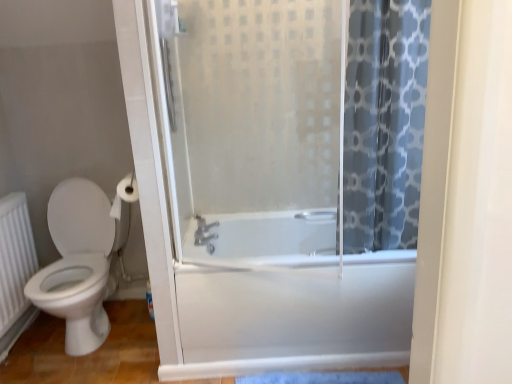
Identify the location of white matte toilet paper at upper left. The image size is (512, 384). tap(124, 194).

The image size is (512, 384). I want to click on white textured radiator at lower left, so click(15, 258).

Find the location of `white glossy bathtub at center`. white glossy bathtub at center is located at coordinates (290, 292).

What is the approximate width of satin nickel faucet at center?

satin nickel faucet at center is 5.53 inches in width.

The width and height of the screenshot is (512, 384). I want to click on blue printed fabric at right, so click(x=384, y=123).

At what (x,y) coordinates should I click in order to perform the action: click on frosted glass shower door at center. Please return your answer as a coordinate pair (x, y). The height and width of the screenshot is (384, 512). Looking at the image, I should click on (253, 127).

Would you say white textured radiator at lower left contains blue printed fabric at right?

No.

Is there a large distance between white textured radiator at lower left and blue printed fabric at right?

Yes.

Is white textured radiator at lower left oriented away from blue printed fabric at right?

No, white textured radiator at lower left's orientation is not away from blue printed fabric at right.

Considering the positions of objects white textured radiator at lower left and blue printed fabric at right in the image provided, who is behind, white textured radiator at lower left or blue printed fabric at right?

white textured radiator at lower left is further from the camera.

Considering the relative sizes of white glossy bathtub at center and frosted glass shower door at center in the image provided, is white glossy bathtub at center shorter than frosted glass shower door at center?

Yes, white glossy bathtub at center is shorter than frosted glass shower door at center.

From a real-world perspective, is white glossy bathtub at center on frosted glass shower door at center?

No, from a real-world perspective, white glossy bathtub at center is not over frosted glass shower door at center

Is white glossy bathtub at center directly adjacent to frosted glass shower door at center?

No, white glossy bathtub at center is not in contact with frosted glass shower door at center.

Is point (262, 242) closer or farther from the camera than point (191, 80)?

Point (262, 242) appears to be farther away from the viewer than point (191, 80).

Is white glossy toilet at left not close to white matte toilet paper at upper left?

white glossy toilet at left is actually quite close to white matte toilet paper at upper left.

From the image's perspective, which object appears higher, white glossy toilet at left or white matte toilet paper at upper left?

white matte toilet paper at upper left.

At what (x,y) coordinates should I click in order to perform the action: click on toilet located on the left of white matte toilet paper at upper left. Please return your answer as a coordinate pair (x, y). Looking at the image, I should click on (80, 262).

Who is taller, frosted glass shower door at center or blue printed fabric at right?

blue printed fabric at right is taller.

Is frosted glass shower door at center bigger or smaller than blue printed fabric at right?

In the image, frosted glass shower door at center appears to be smaller than blue printed fabric at right.

Is frosted glass shower door at center not close to blue printed fabric at right?

They are positioned close to each other.

Is frosted glass shower door at center surrounding white glossy toilet at left?

No.

The height and width of the screenshot is (384, 512). I want to click on screen door that is above the white glossy toilet at left (from the image's perspective), so click(253, 127).

Are frosted glass shower door at center and white glossy toilet at left beside each other?

No.

In terms of height, does frosted glass shower door at center look taller or shorter compared to white glossy toilet at left?

In the image, frosted glass shower door at center appears to be taller than white glossy toilet at left.

Between satin nickel faucet at center and white glossy bathtub at center, which one has smaller width?

Thinner between the two is satin nickel faucet at center.

Is satin nickel faucet at center oriented away from white glossy bathtub at center?

No, satin nickel faucet at center is not facing the opposite direction of white glossy bathtub at center.

Which is in front, satin nickel faucet at center or white glossy bathtub at center?

white glossy bathtub at center is more forward.

What are the coordinates of `bath below the satin nickel faucet at center (from the image's perspective)` in the screenshot? It's located at (290, 292).

Looking at their sizes, would you say white glossy bathtub at center is wider or thinner than white glossy toilet at left?

Clearly, white glossy bathtub at center has more width compared to white glossy toilet at left.

Considering the relative sizes of white glossy bathtub at center and white glossy toilet at left in the image provided, is white glossy bathtub at center shorter than white glossy toilet at left?

Correct, white glossy bathtub at center is not as tall as white glossy toilet at left.

Where is `bath on the right of white glossy toilet at left`? The image size is (512, 384). bath on the right of white glossy toilet at left is located at coordinates (290, 292).

Identify the location of radiator below the blue printed fabric at right (from a real-world perspective). The width and height of the screenshot is (512, 384). (15, 258).

Where is `bath on the right of frosted glass shower door at center`? bath on the right of frosted glass shower door at center is located at coordinates (290, 292).

Based on the photo, estimate the real-world distances between objects in this image. Which object is further from blue printed fabric at right, white textured radiator at lower left or frosted glass shower door at center?

Based on the image, white textured radiator at lower left appears to be further to blue printed fabric at right.

Estimate the real-world distances between objects in this image. Which object is further from blue printed fabric at right, satin nickel faucet at center or white glossy toilet at left?

white glossy toilet at left is positioned further to the anchor blue printed fabric at right.

Looking at the image, which one is located closer to satin nickel faucet at center, white textured radiator at lower left or frosted glass shower door at center?

Based on the image, frosted glass shower door at center appears to be nearer to satin nickel faucet at center.

Looking at the image, which one is located further to white matte toilet paper at upper left, white textured radiator at lower left or blue printed fabric at right?

blue printed fabric at right is further to white matte toilet paper at upper left.

Considering their positions, is satin nickel faucet at center positioned closer to frosted glass shower door at center than white glossy bathtub at center?

The object closer to frosted glass shower door at center is white glossy bathtub at center.

Looking at the image, which one is located closer to satin nickel faucet at center, white matte toilet paper at upper left or white glossy bathtub at center?

The object closer to satin nickel faucet at center is white matte toilet paper at upper left.

Considering their positions, is blue printed fabric at right positioned further to white matte toilet paper at upper left than white textured radiator at lower left?

blue printed fabric at right is further to white matte toilet paper at upper left.

Based on their spatial positions, is white glossy bathtub at center or satin nickel faucet at center closer to white textured radiator at lower left?

satin nickel faucet at center lies closer to white textured radiator at lower left than the other object.

At what (x,y) coordinates should I click in order to perform the action: click on toilet located between white textured radiator at lower left and frosted glass shower door at center in the left-right direction. Please return your answer as a coordinate pair (x, y). The image size is (512, 384). Looking at the image, I should click on (80, 262).

Find the location of a particular element. The image size is (512, 384). screen door situated between white textured radiator at lower left and blue printed fabric at right from left to right is located at coordinates (253, 127).

Find the location of `shower between white matte toilet paper at upper left and blue printed fabric at right in the horizontal direction`. shower between white matte toilet paper at upper left and blue printed fabric at right in the horizontal direction is located at coordinates (204, 233).

At what (x,y) coordinates should I click in order to perform the action: click on toilet paper between white glossy toilet at left and frosted glass shower door at center from left to right. Please return your answer as a coordinate pair (x, y). The width and height of the screenshot is (512, 384). Looking at the image, I should click on (124, 194).